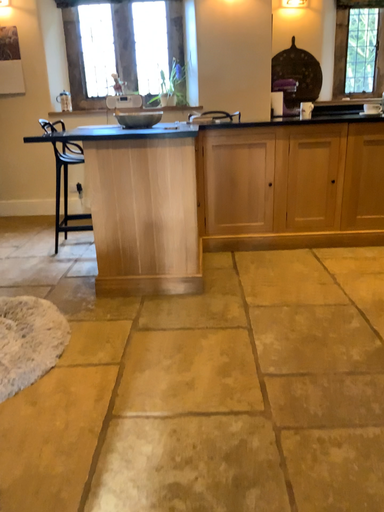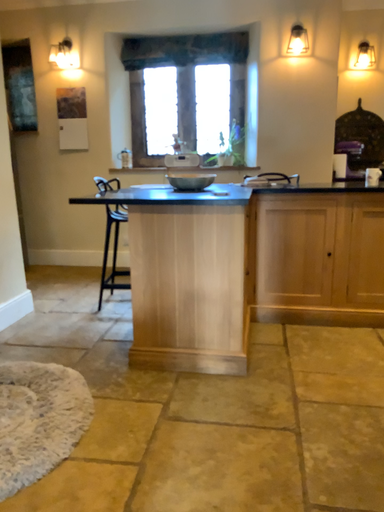
Question: Which way did the camera rotate in the video?

Choices:
 (A) rotated right
 (B) rotated left

Answer: (B)